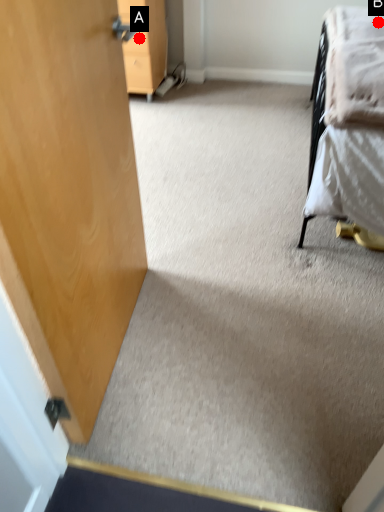
Question: Two points are circled on the image, labeled by A and B beside each circle. Which point is closer to the camera?

Choices:
 (A) A is closer
 (B) B is closer

Answer: (B)